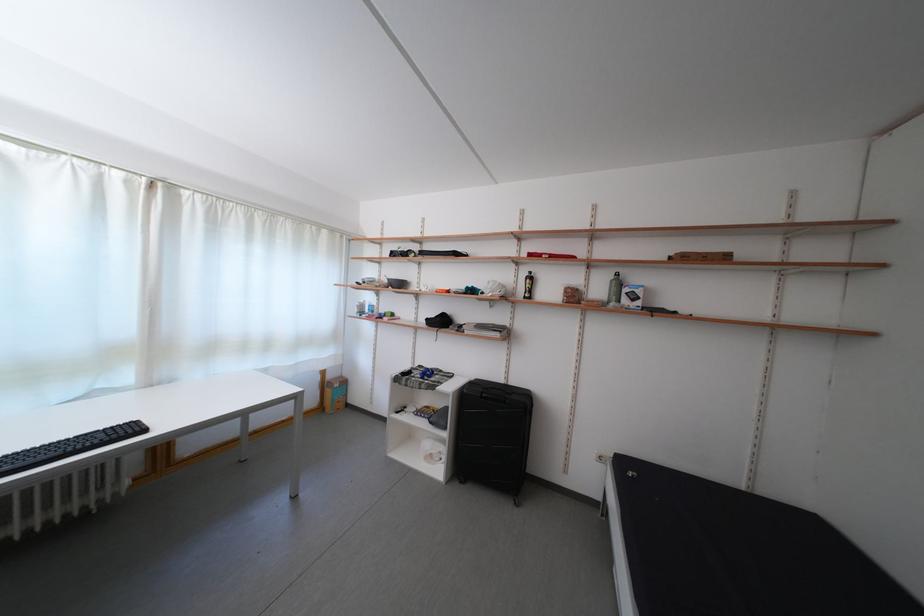
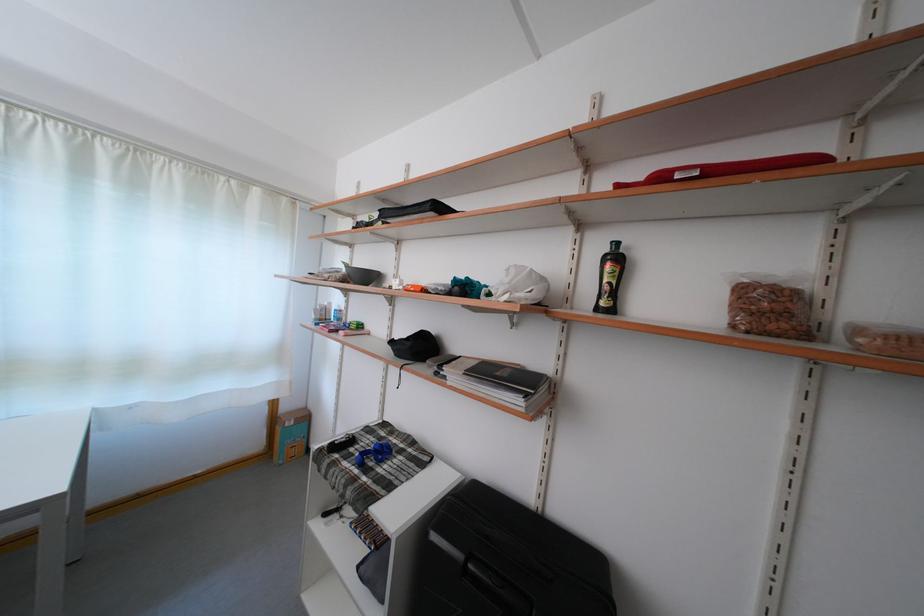
The point at (x=421, y=382) is marked in the first image. Where is the corresponding point in the second image?

(358, 462)